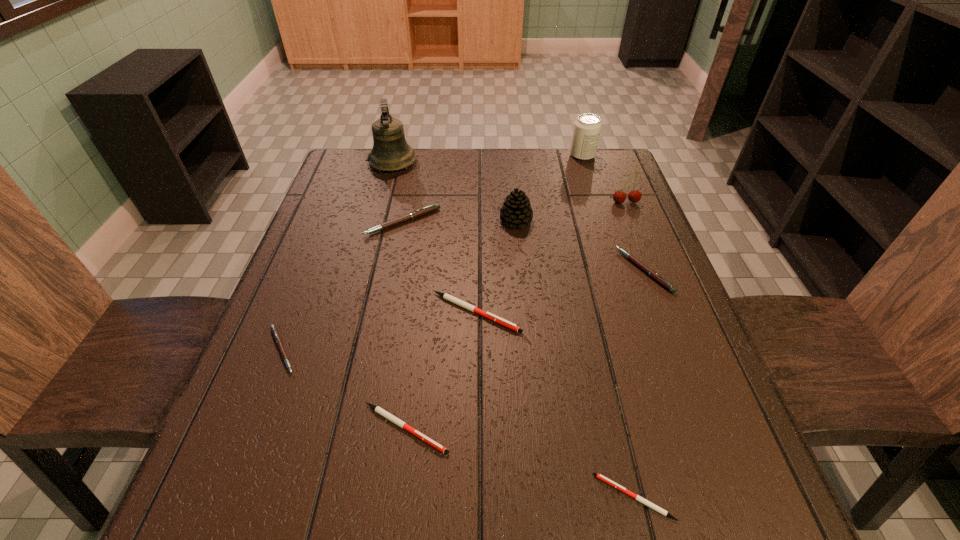
In order to click on vacant space located 0.090m on the clicker of the rightmost white pen in this screenshot , I will do `click(539, 497)`.

Where is `bell situated at the far edge`? The height and width of the screenshot is (540, 960). bell situated at the far edge is located at coordinates (390, 152).

In order to click on soda can present at the far edge in this screenshot , I will do `click(587, 127)`.

The height and width of the screenshot is (540, 960). I want to click on object present at the near edge, so click(599, 476).

Where is `bell that is at the left edge`? The height and width of the screenshot is (540, 960). bell that is at the left edge is located at coordinates click(x=390, y=152).

Locate an element on the screen. The image size is (960, 540). soda can situated at the right edge is located at coordinates (587, 127).

Locate an element on the screen. This screenshot has width=960, height=540. cherry that is positioned at the right edge is located at coordinates (634, 196).

At what (x,y) coordinates should I click in order to perform the action: click on object that is positioned at the far left corner. Please return your answer as a coordinate pair (x, y). The image size is (960, 540). Looking at the image, I should click on (390, 152).

Locate an element on the screen. object that is at the far right corner is located at coordinates (587, 127).

Where is `object at the near right corner`? The width and height of the screenshot is (960, 540). object at the near right corner is located at coordinates (599, 476).